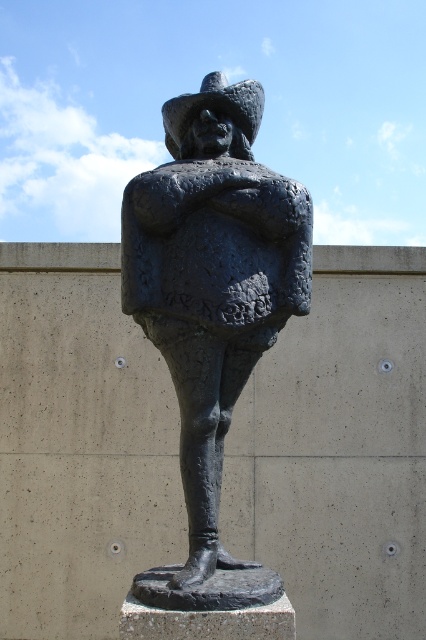
Is bronze statue at center taller than dark gray textured hat at upper center?

Yes, bronze statue at center is taller than dark gray textured hat at upper center.

The width and height of the screenshot is (426, 640). What are the coordinates of `bronze statue at center` in the screenshot? It's located at (213, 280).

The image size is (426, 640). I want to click on bronze statue at center, so [x=213, y=280].